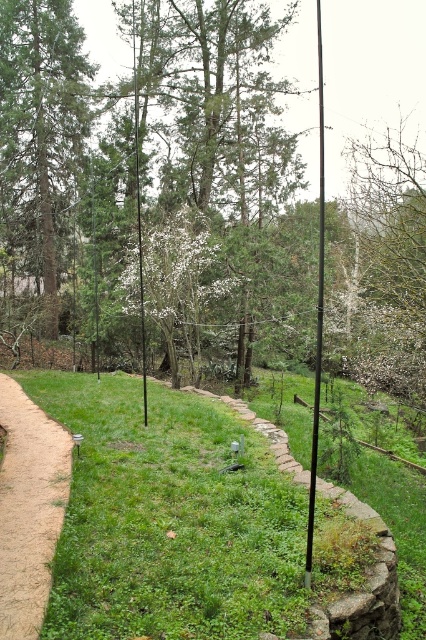
Question: Considering the real-world distances, which object is farthest from the green leafy tree at center?

Choices:
 (A) white textured tree at center
 (B) green grass at center

Answer: (B)

Question: Does brown dirt path at left have a larger size compared to white textured tree at center?

Choices:
 (A) no
 (B) yes

Answer: (A)

Question: Which object is the farthest from the brown dirt path at left?

Choices:
 (A) green matte pole at center
 (B) green matte tree at left
 (C) green grass at center

Answer: (B)

Question: Is white textured tree at center to the right of black metal pole at center from the viewer's perspective?

Choices:
 (A) no
 (B) yes

Answer: (A)

Question: Which point is farther to the camera?

Choices:
 (A) (213, 173)
 (B) (137, 144)
 (C) (40, 29)

Answer: (C)

Question: Is green grass at center thinner than brown dirt path at left?

Choices:
 (A) yes
 (B) no

Answer: (B)